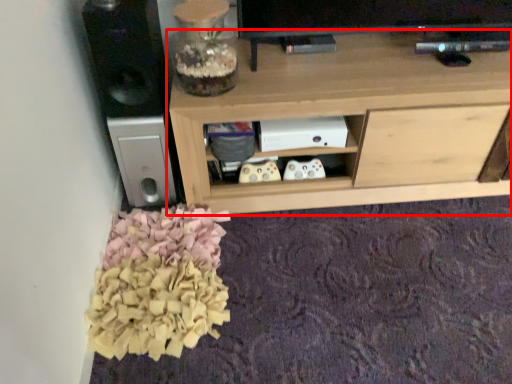
Question: From the image's perspective, considering the relative positions of shelf (annotated by the red box) and speaker in the image provided, where is shelf (annotated by the red box) located with respect to the staircase?

Choices:
 (A) below
 (B) above

Answer: (A)